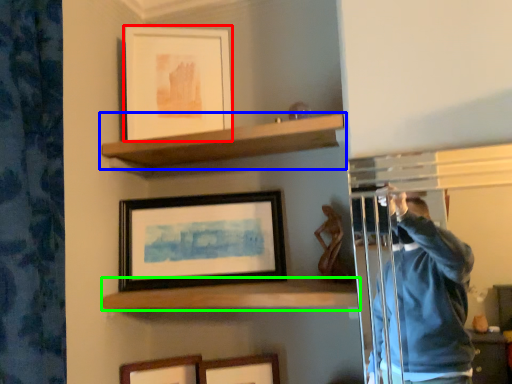
Question: Estimate the real-world distances between objects in this image. Which object is farther from picture frame (highlighted by a red box), shelf (highlighted by a blue box) or shelf (highlighted by a green box)?

Choices:
 (A) shelf
 (B) shelf

Answer: (B)